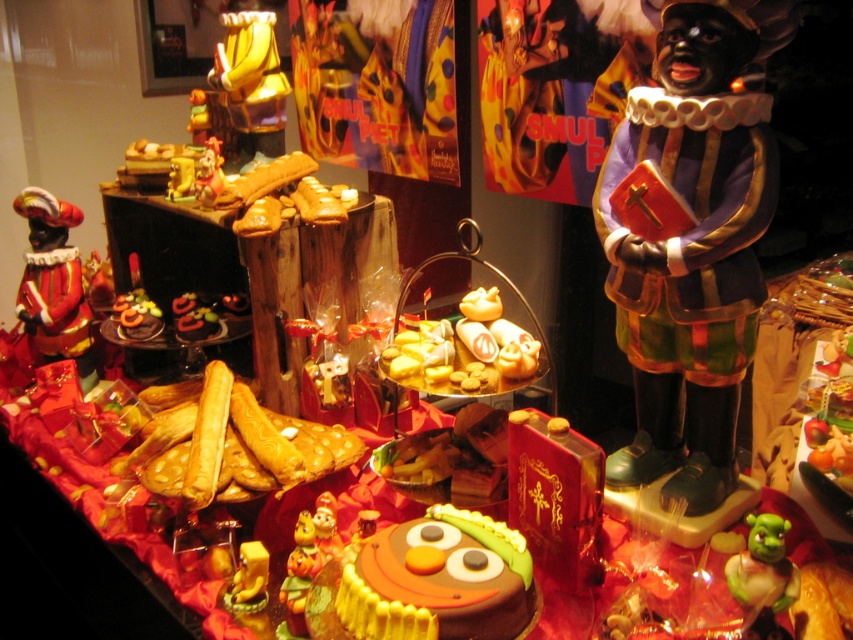
Question: Estimate the real-world distances between objects in this image. Which object is closer to the green rubber toy at lower right?

Choices:
 (A) shiny gold statue at upper center
 (B) chocolate cake at center
 (C) matte red wood figure at left
 (D) matte gold figurine at upper left

Answer: (B)

Question: Does shiny gold statue at upper center have a smaller size compared to matte gold figurine at upper left?

Choices:
 (A) no
 (B) yes

Answer: (A)

Question: Among these points, which one is farthest from the camera?

Choices:
 (A) (384, 580)
 (B) (212, 164)
 (C) (201, 131)
 (D) (749, 589)

Answer: (C)

Question: Which point is farther to the camera?

Choices:
 (A) (42, 228)
 (B) (469, 604)
 (C) (216, 172)

Answer: (A)

Question: Does matte red wood figure at left have a lesser width compared to shiny gold statue at upper center?

Choices:
 (A) yes
 (B) no

Answer: (B)

Question: Where is matte red wood figure at left located in relation to shiny gold statue at upper center in the image?

Choices:
 (A) right
 (B) left

Answer: (B)